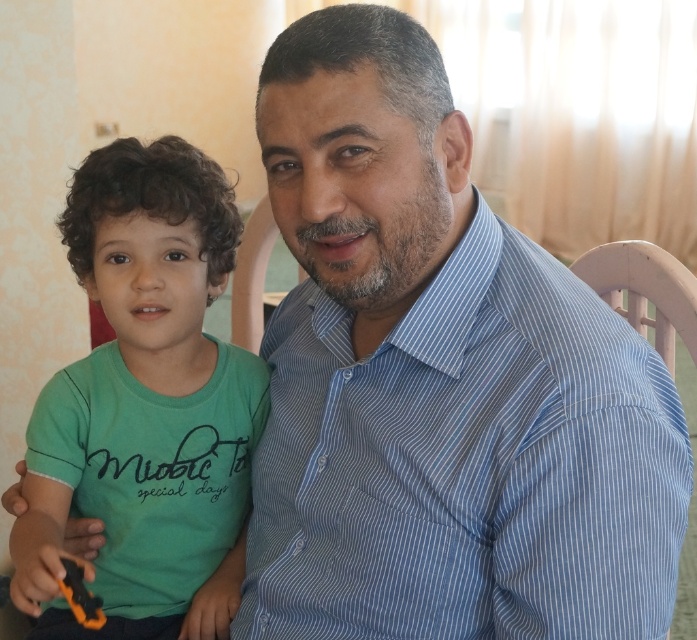
Question: Is blue striped shirt at center to the right of orange plastic toy at lower left from the viewer's perspective?

Choices:
 (A) no
 (B) yes

Answer: (B)

Question: Is green matte shirt at left thinner than orange plastic toy at lower left?

Choices:
 (A) yes
 (B) no

Answer: (B)

Question: Based on their relative distances, which object is nearer to the blue striped shirt at center?

Choices:
 (A) green matte shirt at left
 (B) orange plastic toy at lower left

Answer: (A)

Question: Considering the relative positions of green matte shirt at left and orange plastic toy at lower left in the image provided, where is green matte shirt at left located with respect to orange plastic toy at lower left?

Choices:
 (A) below
 (B) above

Answer: (B)

Question: Which of the following is the farthest from the observer?

Choices:
 (A) blue striped shirt at center
 (B) green matte shirt at left
 (C) orange plastic toy at lower left

Answer: (B)

Question: Which object is the closest to the orange plastic toy at lower left?

Choices:
 (A) green matte shirt at left
 (B) blue striped shirt at center

Answer: (A)